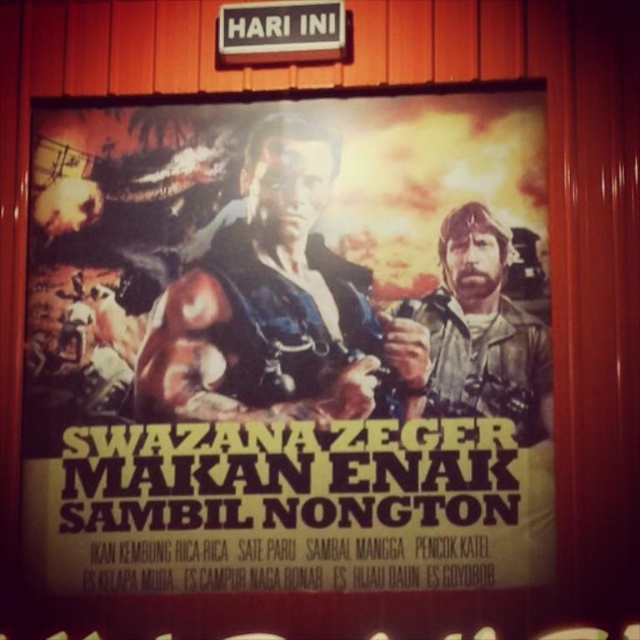
You are an art installer setting up a display. You have a matte paper poster at center and need to place it precisely at coordinates point (289, 342). The red wooden background is your canvas. Where should you position the matte paper poster at center?

The point (289, 342) indicates where the matte paper poster at center should be placed on the red wooden background.